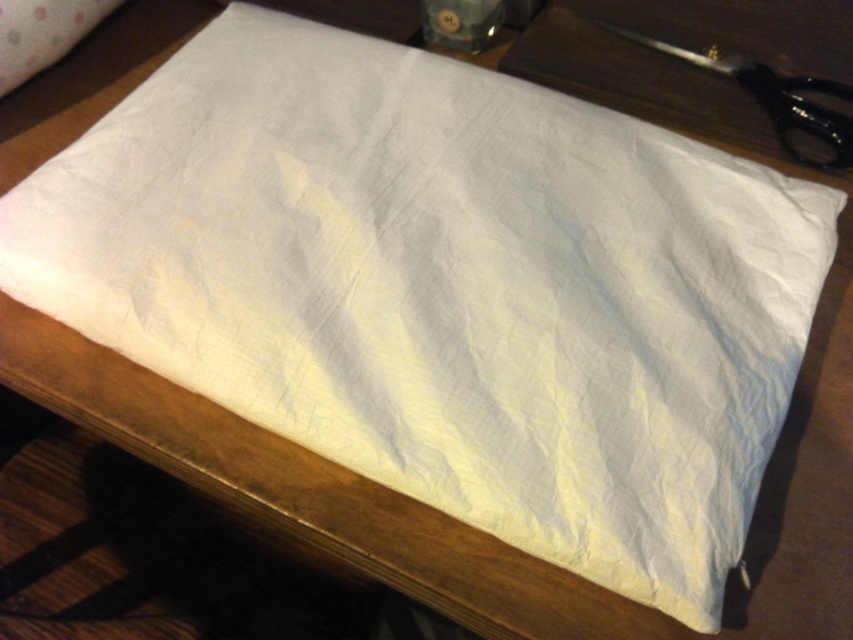
Question: Which point is farther from the camera taking this photo?

Choices:
 (A) (91, 8)
 (B) (689, 61)

Answer: (B)

Question: Is black plastic scissors at upper right above white fabric pillow at upper left?

Choices:
 (A) no
 (B) yes

Answer: (A)

Question: Can you confirm if black plastic scissors at upper right is thinner than white fabric pillow at upper left?

Choices:
 (A) yes
 (B) no

Answer: (B)

Question: Does black plastic scissors at upper right appear on the left side of white fabric pillow at upper left?

Choices:
 (A) yes
 (B) no

Answer: (B)

Question: Which of the following is the closest to the observer?

Choices:
 (A) black plastic scissors at upper right
 (B) white fabric pillow at upper left

Answer: (B)

Question: Among these objects, which one is farthest from the camera?

Choices:
 (A) black plastic scissors at upper right
 (B) white fabric pillow at upper left

Answer: (A)